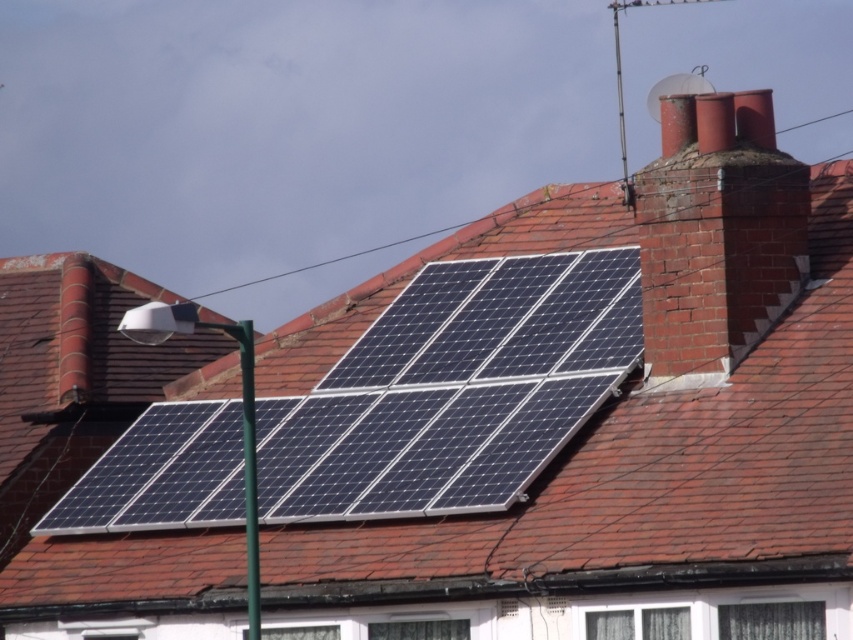
Image resolution: width=853 pixels, height=640 pixels. I want to click on dark blue solar panels at center, so click(x=577, y=413).

Between dark blue solar panels at center and red brick chimney at upper right, which one appears on the left side from the viewer's perspective?

From the viewer's perspective, dark blue solar panels at center appears more on the left side.

Is point (387, 328) more distant than point (722, 266)?

That is True.

The image size is (853, 640). I want to click on dark blue solar panels at center, so click(577, 413).